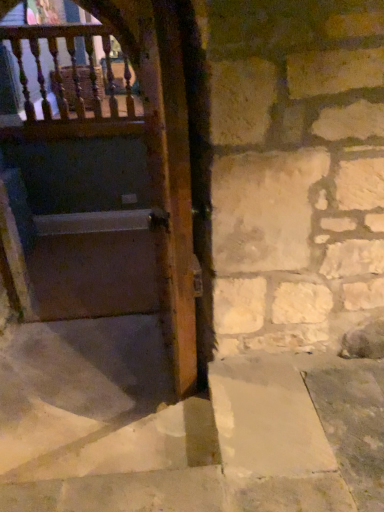
Question: Would you say smooth concrete stairs at center is inside or outside wooden balusters at upper left?

Choices:
 (A) outside
 (B) inside

Answer: (A)

Question: From a real-world perspective, relative to wooden balusters at upper left, is smooth concrete stairs at center vertically above or below?

Choices:
 (A) below
 (B) above

Answer: (A)

Question: Based on their relative distances, which object is nearer to the wooden balusters at upper left?

Choices:
 (A) matte wooden door at left
 (B) smooth concrete stairs at center

Answer: (A)

Question: Estimate the real-world distances between objects in this image. Which object is farther from the matte wooden door at left?

Choices:
 (A) smooth concrete stairs at center
 (B) wooden balusters at upper left

Answer: (A)